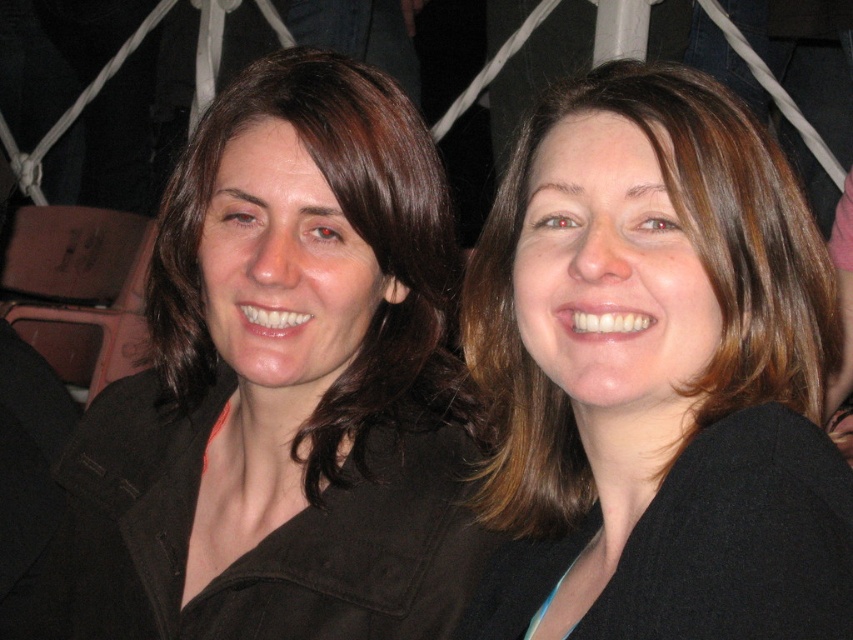
Question: Does matte black jacket at center have a larger size compared to brown matte/black jacket at center?

Choices:
 (A) yes
 (B) no

Answer: (A)

Question: Which point appears closest to the camera in this image?

Choices:
 (A) (602, 179)
 (B) (102, 403)

Answer: (A)

Question: Is matte black jacket at center below brown matte/black jacket at center?

Choices:
 (A) no
 (B) yes

Answer: (B)

Question: Which object appears farthest from the camera in this image?

Choices:
 (A) brown matte/black jacket at center
 (B) matte black jacket at center

Answer: (B)

Question: Can you confirm if matte black jacket at center is positioned below brown matte/black jacket at center?

Choices:
 (A) no
 (B) yes

Answer: (B)